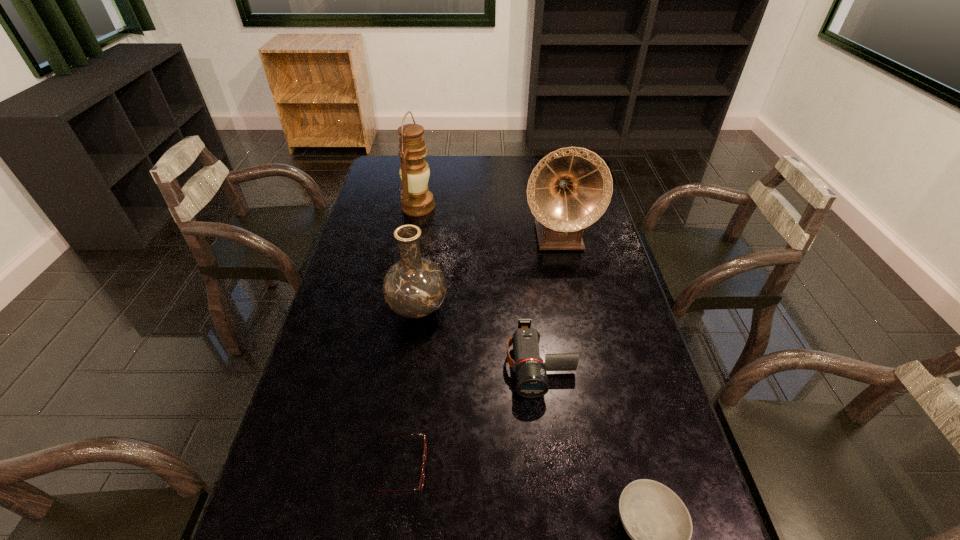
The image size is (960, 540). Identify the location of vacant area that lies between the oil lamp and the spectacles. (408, 337).

The width and height of the screenshot is (960, 540). Find the location of `blank region between the shortest object and the oil lamp`. blank region between the shortest object and the oil lamp is located at coordinates (408, 337).

Locate an element on the screen. free space between the shortest object and the phonograph record is located at coordinates (478, 352).

This screenshot has height=540, width=960. Find the location of `free spot between the spectacles and the vase`. free spot between the spectacles and the vase is located at coordinates (408, 388).

Find the location of a particular element. The image size is (960, 540). free spot between the third tallest object and the spectacles is located at coordinates (408, 388).

Locate which object ranks in proximity to the fourth shortest object. Please provide its 2D coordinates. Your answer should be formatted as a tuple, i.e. [(x, y)], where the tuple contains the x and y coordinates of a point satisfying the conditions above.

[(531, 377)]

The image size is (960, 540). Find the location of `object identified as the second closest to the fourth nearest object`. object identified as the second closest to the fourth nearest object is located at coordinates (569, 189).

Locate an element on the screen. Image resolution: width=960 pixels, height=540 pixels. vacant space that satisfies the following two spatial constraints: 1. on the horn of the phonograph record; 2. on the lenses of the spectacles is located at coordinates (607, 468).